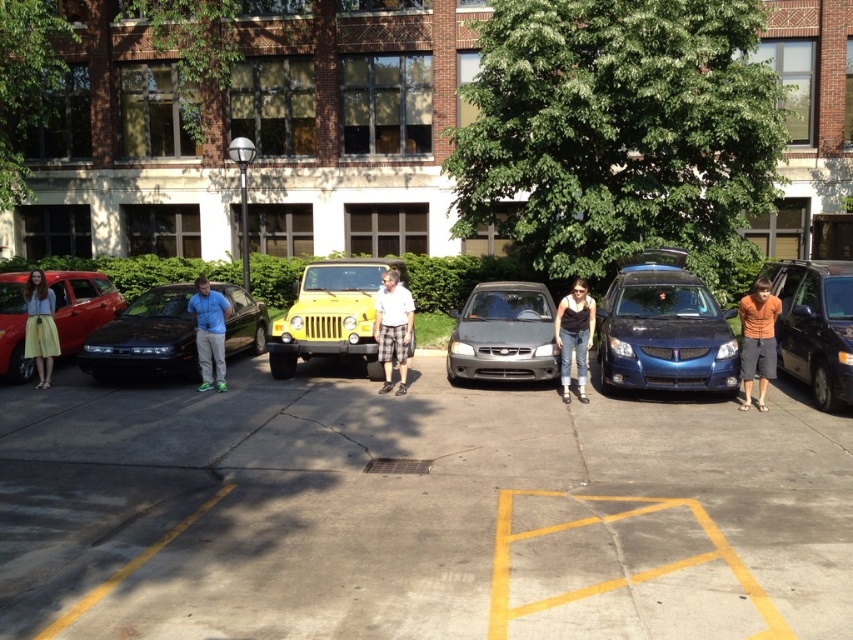
You are a delivery person trying to park your van between the glossy black sedan at center and the yellow matte jeep at center. Can you safely park there if your van requires 2 meters of space?

The glossy black sedan at center is closer to the viewer than the yellow matte jeep at center, so there is not enough space between them to park a van requiring 2 meters.

You are standing at point [80,305] in the parking lot. Which car is directly in front of you?

The point [80,305] marks the matte red car at left, so the matte red car at left is directly in front of you.